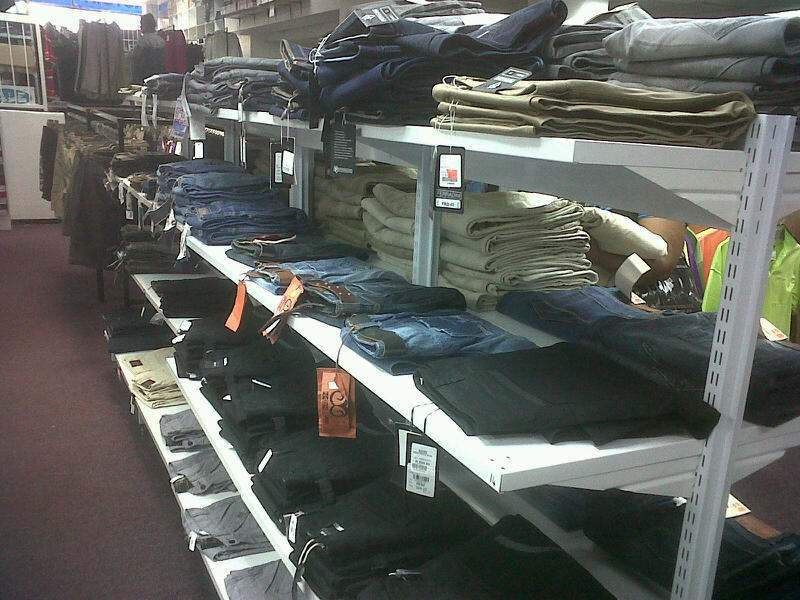
You are a GUI agent. You are given a task and a screenshot of the screen. Output one action in this format:
    pyautogui.click(x=<x>, y=<y>)
    Task: Click on the top white shelf
    Image resolution: width=800 pixels, height=600 pixels.
    Given the screenshot: What is the action you would take?
    pyautogui.click(x=598, y=152)